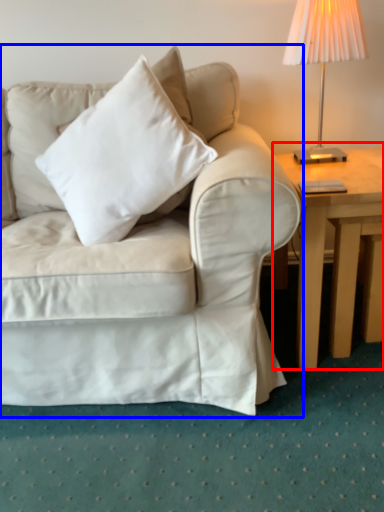
Question: Which object appears farthest to the camera in this image, table (highlighted by a red box) or studio couch (highlighted by a blue box)?

Choices:
 (A) table
 (B) studio couch

Answer: (A)